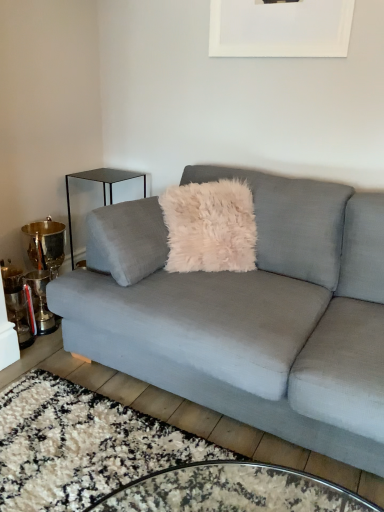
Question: Is velvet gray couch at center at the back of white matte picture frame at upper center?

Choices:
 (A) no
 (B) yes

Answer: (A)

Question: Is white matte picture frame at upper center completely or partially outside of velvet gray couch at center?

Choices:
 (A) yes
 (B) no

Answer: (A)

Question: Can you confirm if white matte picture frame at upper center is positioned to the left of velvet gray couch at center?

Choices:
 (A) no
 (B) yes

Answer: (A)

Question: From a real-world perspective, is white matte picture frame at upper center on velvet gray couch at center?

Choices:
 (A) no
 (B) yes

Answer: (B)

Question: From the image's perspective, is white matte picture frame at upper center below velvet gray couch at center?

Choices:
 (A) yes
 (B) no

Answer: (B)

Question: Is white matte picture frame at upper center taller than velvet gray couch at center?

Choices:
 (A) no
 (B) yes

Answer: (A)

Question: Does black glass side table at left touch velvet gray couch at center?

Choices:
 (A) no
 (B) yes

Answer: (A)

Question: Does black glass side table at left have a lesser width compared to velvet gray couch at center?

Choices:
 (A) yes
 (B) no

Answer: (A)

Question: Considering the relative sizes of black glass side table at left and velvet gray couch at center in the image provided, is black glass side table at left wider than velvet gray couch at center?

Choices:
 (A) no
 (B) yes

Answer: (A)

Question: Can you confirm if black glass side table at left is taller than velvet gray couch at center?

Choices:
 (A) no
 (B) yes

Answer: (A)

Question: Is velvet gray couch at center a part of black glass side table at left?

Choices:
 (A) yes
 (B) no

Answer: (B)

Question: Is black glass side table at left to the right of velvet gray couch at center from the viewer's perspective?

Choices:
 (A) no
 (B) yes

Answer: (A)

Question: Can you confirm if velvet gray couch at center is smaller than black glass side table at left?

Choices:
 (A) yes
 (B) no

Answer: (B)